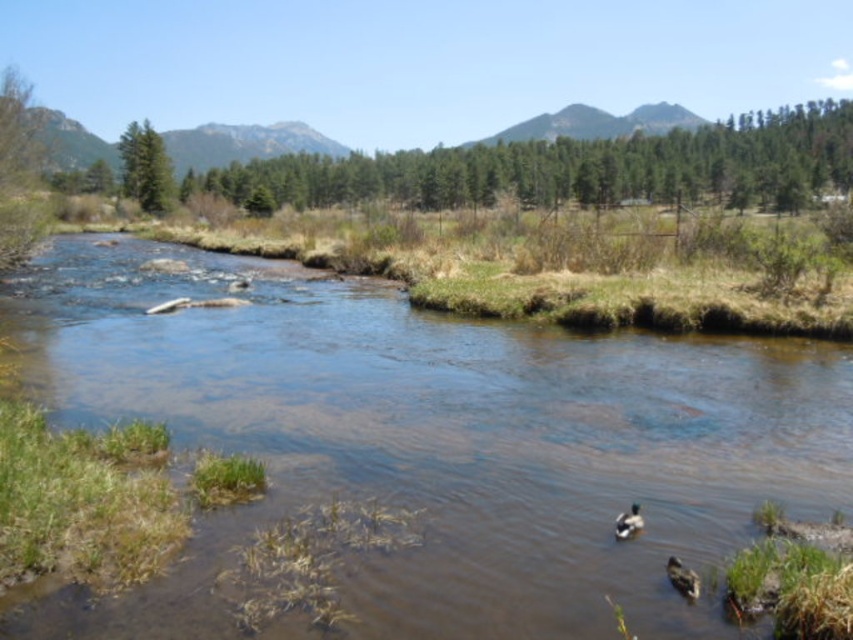
Question: Can you confirm if clear water at center is positioned below brown matte duck at lower right?

Choices:
 (A) yes
 (B) no

Answer: (B)

Question: Among these points, which one is nearest to the camera?

Choices:
 (A) (637, 531)
 (B) (20, 314)

Answer: (A)

Question: Which is farther from the brown matte duck at lower right?

Choices:
 (A) clear water at center
 (B) brown fuzzy duck at lower center

Answer: (A)

Question: Which point appears farthest from the camera in this image?

Choices:
 (A) (619, 525)
 (B) (281, 481)

Answer: (B)

Question: Is brown matte duck at lower right positioned at the back of brown fuzzy duck at lower center?

Choices:
 (A) no
 (B) yes

Answer: (A)

Question: Does clear water at center appear over brown fuzzy duck at lower center?

Choices:
 (A) yes
 (B) no

Answer: (A)